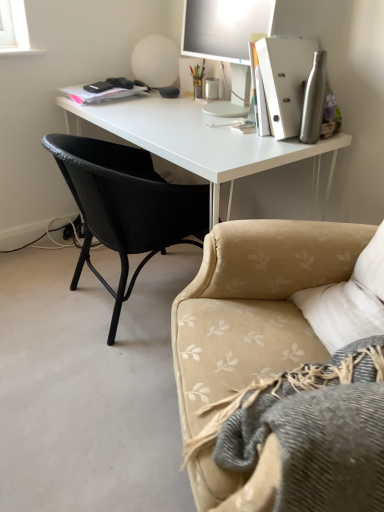
Question: Can you confirm if black woven chair at left is thinner than beige floral fabric couch at lower right?

Choices:
 (A) no
 (B) yes

Answer: (A)

Question: Is black woven chair at left in front of beige floral fabric couch at lower right?

Choices:
 (A) no
 (B) yes

Answer: (A)

Question: Could you tell me if black woven chair at left is turned towards beige floral fabric couch at lower right?

Choices:
 (A) yes
 (B) no

Answer: (B)

Question: Is black woven chair at left to the left of beige floral fabric couch at lower right from the viewer's perspective?

Choices:
 (A) yes
 (B) no

Answer: (A)

Question: Can you confirm if black woven chair at left is smaller than beige floral fabric couch at lower right?

Choices:
 (A) no
 (B) yes

Answer: (A)

Question: Is black woven chair at left positioned with its back to beige floral fabric couch at lower right?

Choices:
 (A) yes
 (B) no

Answer: (B)

Question: Is beige floral fabric couch at lower right located within silver metallic water bottle at right?

Choices:
 (A) no
 (B) yes

Answer: (A)

Question: Does silver metallic water bottle at right appear on the right side of beige floral fabric couch at lower right?

Choices:
 (A) yes
 (B) no

Answer: (A)

Question: Does silver metallic water bottle at right have a larger size compared to beige floral fabric couch at lower right?

Choices:
 (A) no
 (B) yes

Answer: (A)

Question: Is silver metallic water bottle at right positioned in front of beige floral fabric couch at lower right?

Choices:
 (A) no
 (B) yes

Answer: (A)

Question: From the image's perspective, is silver metallic water bottle at right on beige floral fabric couch at lower right?

Choices:
 (A) yes
 (B) no

Answer: (A)

Question: Is silver metallic water bottle at right with beige floral fabric couch at lower right?

Choices:
 (A) no
 (B) yes

Answer: (A)

Question: Considering the relative sizes of white matte desk at center and beige floral fabric couch at lower right in the image provided, is white matte desk at center smaller than beige floral fabric couch at lower right?

Choices:
 (A) yes
 (B) no

Answer: (B)